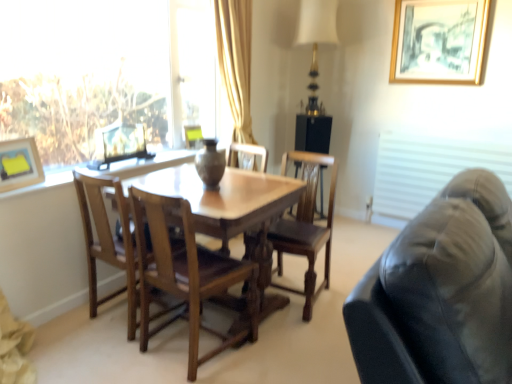
At what (x,y) coordinates should I click in order to perform the action: click on vacant region to the left of light brown wood chair at center, which is the 3th chair in right-to-left order. Please return your answer as a coordinate pair (x, y). The image size is (512, 384). Looking at the image, I should click on (75, 316).